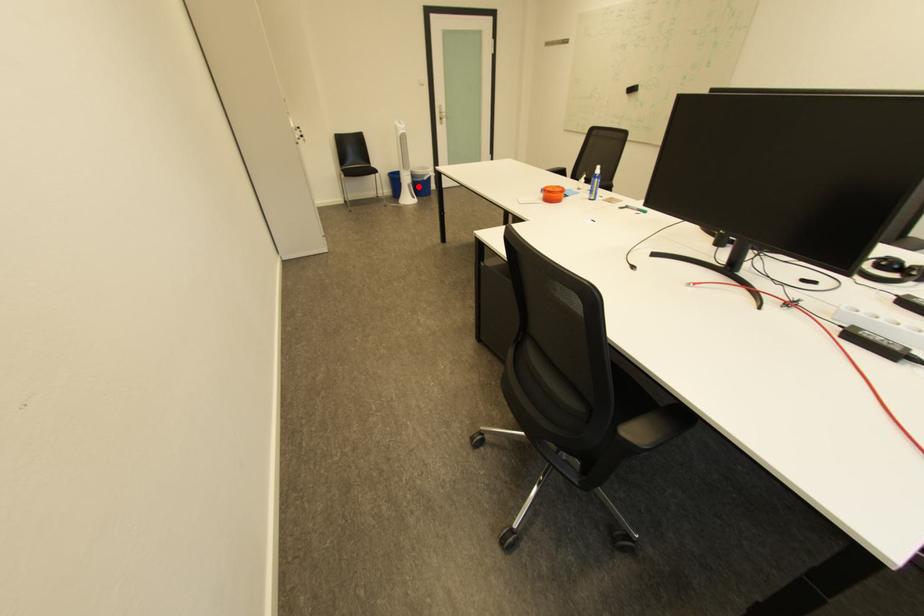
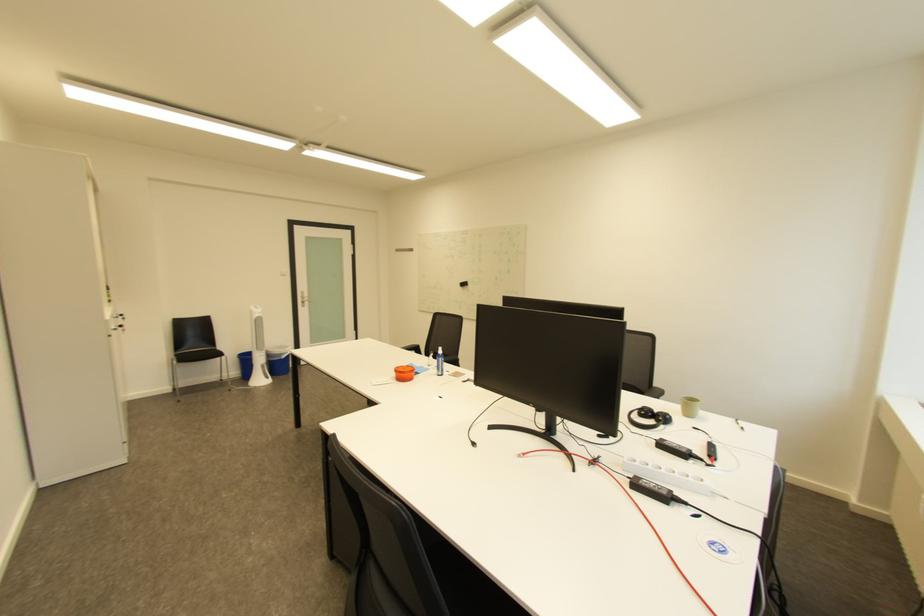
Find the pixel in the second image that matches the highlighted location in the first image.

(273, 367)